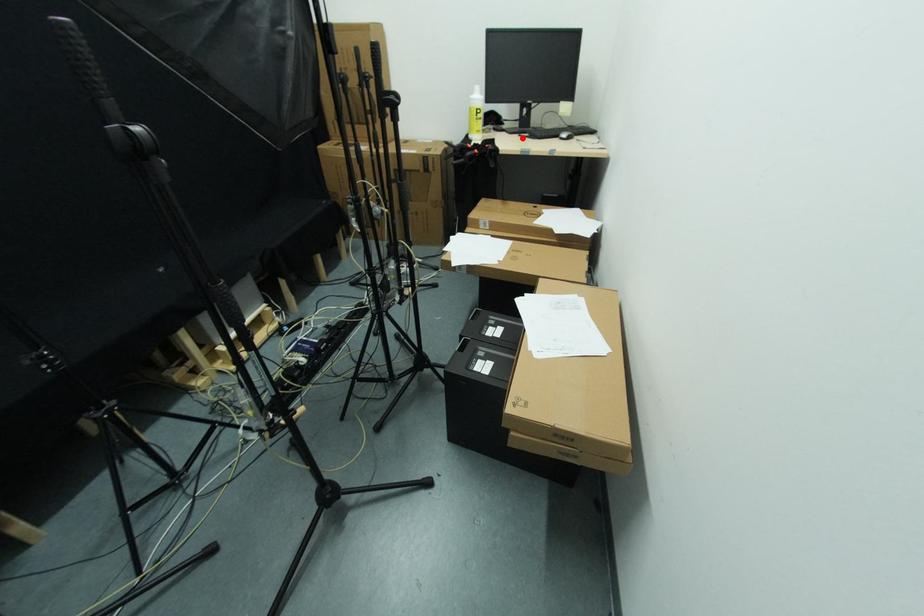
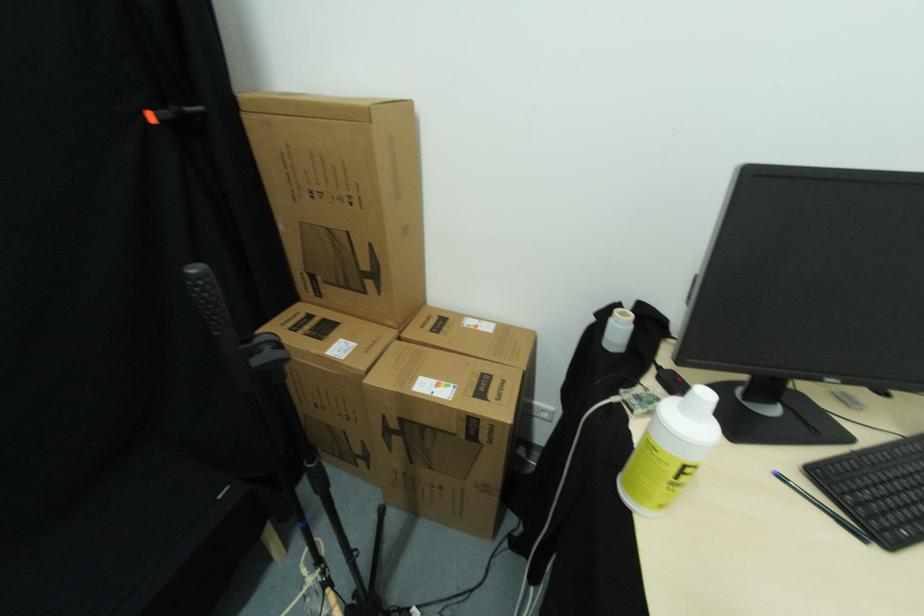
Find the pixel in the second image that matches the highlighted location in the first image.

(784, 479)